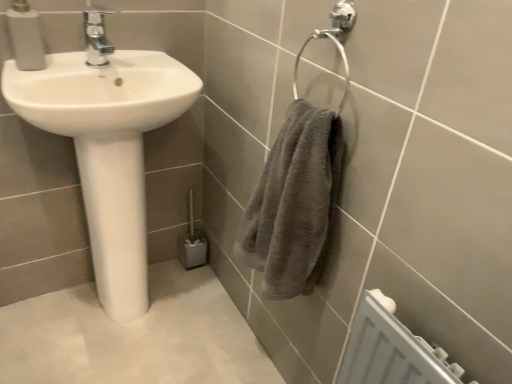
Question: Considering the relative sizes of white glossy sink at left and gray fluffy towel at right in the image provided, is white glossy sink at left thinner than gray fluffy towel at right?

Choices:
 (A) no
 (B) yes

Answer: (A)

Question: Does white glossy sink at left have a smaller size compared to gray fluffy towel at right?

Choices:
 (A) no
 (B) yes

Answer: (A)

Question: Can you confirm if white glossy sink at left is positioned to the left of gray fluffy towel at right?

Choices:
 (A) no
 (B) yes

Answer: (B)

Question: Are white glossy sink at left and gray fluffy towel at right making contact?

Choices:
 (A) no
 (B) yes

Answer: (A)

Question: From the image's perspective, is white glossy sink at left located beneath gray fluffy towel at right?

Choices:
 (A) yes
 (B) no

Answer: (A)

Question: Do you think chrome metallic faucet at upper center is within gray fluffy towel at right, or outside of it?

Choices:
 (A) outside
 (B) inside

Answer: (A)

Question: From their relative heights in the image, would you say chrome metallic faucet at upper center is taller or shorter than gray fluffy towel at right?

Choices:
 (A) tall
 (B) short

Answer: (B)

Question: From the image's perspective, is chrome metallic faucet at upper center above or below gray fluffy towel at right?

Choices:
 (A) above
 (B) below

Answer: (A)

Question: In the image, is chrome metallic faucet at upper center positioned in front of or behind gray fluffy towel at right?

Choices:
 (A) front
 (B) behind

Answer: (B)

Question: In terms of width, does matte white soap dispenser at upper left look wider or thinner when compared to gray fluffy towel at right?

Choices:
 (A) thin
 (B) wide

Answer: (A)

Question: Based on their sizes in the image, would you say matte white soap dispenser at upper left is bigger or smaller than gray fluffy towel at right?

Choices:
 (A) big
 (B) small

Answer: (B)

Question: From a real-world perspective, relative to gray fluffy towel at right, is matte white soap dispenser at upper left vertically above or below?

Choices:
 (A) above
 (B) below

Answer: (A)

Question: Considering the relative positions of matte white soap dispenser at upper left and gray fluffy towel at right in the image provided, is matte white soap dispenser at upper left to the left or to the right of gray fluffy towel at right?

Choices:
 (A) left
 (B) right

Answer: (A)

Question: From a real-world perspective, is gray fluffy towel at right positioned above or below chrome metallic faucet at upper center?

Choices:
 (A) below
 (B) above

Answer: (A)

Question: From the image's perspective, relative to chrome metallic faucet at upper center, is gray fluffy towel at right above or below?

Choices:
 (A) below
 (B) above

Answer: (A)